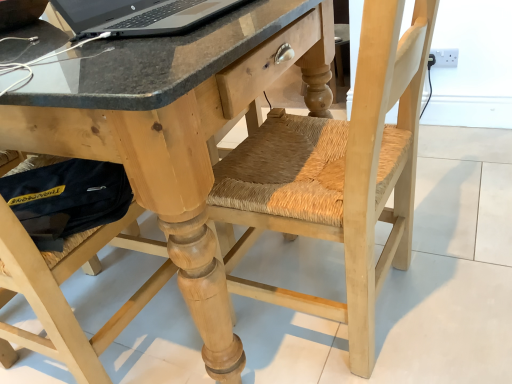
Question: From the image's perspective, would you say natural wood swivel chair at center is positioned over natural wood desk at center?

Choices:
 (A) yes
 (B) no

Answer: (B)

Question: Is natural wood swivel chair at center shorter than natural wood desk at center?

Choices:
 (A) yes
 (B) no

Answer: (B)

Question: Is the depth of natural wood swivel chair at center greater than that of natural wood desk at center?

Choices:
 (A) yes
 (B) no

Answer: (A)

Question: Is natural wood swivel chair at center at the left side of natural wood desk at center?

Choices:
 (A) yes
 (B) no

Answer: (B)

Question: Is natural wood swivel chair at center closer to camera compared to natural wood desk at center?

Choices:
 (A) yes
 (B) no

Answer: (B)

Question: In terms of width, does natural wood desk at center look wider or thinner when compared to natural wood swivel chair at center?

Choices:
 (A) wide
 (B) thin

Answer: (A)

Question: Is natural wood desk at center situated inside natural wood swivel chair at center or outside?

Choices:
 (A) inside
 (B) outside

Answer: (B)

Question: Based on their sizes in the image, would you say natural wood desk at center is bigger or smaller than natural wood swivel chair at center?

Choices:
 (A) big
 (B) small

Answer: (A)

Question: In terms of height, does natural wood desk at center look taller or shorter compared to natural wood swivel chair at center?

Choices:
 (A) short
 (B) tall

Answer: (A)

Question: In the image, is natural wood desk at center positioned in front of or behind silver metallic laptop at upper left?

Choices:
 (A) front
 (B) behind

Answer: (A)

Question: Does point (243, 92) appear closer or farther from the camera than point (89, 3)?

Choices:
 (A) closer
 (B) farther

Answer: (A)

Question: Is natural wood desk at center bigger or smaller than silver metallic laptop at upper left?

Choices:
 (A) big
 (B) small

Answer: (A)

Question: From a real-world perspective, is natural wood desk at center positioned above or below silver metallic laptop at upper left?

Choices:
 (A) above
 (B) below

Answer: (B)

Question: Considering the positions of point (369, 180) and point (186, 24), is point (369, 180) closer or farther from the camera than point (186, 24)?

Choices:
 (A) closer
 (B) farther

Answer: (A)

Question: Is natural wood swivel chair at center bigger or smaller than silver metallic laptop at upper left?

Choices:
 (A) small
 (B) big

Answer: (B)